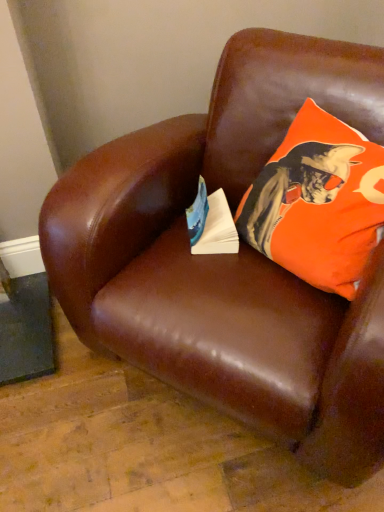
Question: Is point (203, 189) closer or farther from the camera than point (299, 224)?

Choices:
 (A) closer
 (B) farther

Answer: (B)

Question: Considering their positions, is white paper at center located in front of or behind orange fabric pillow at upper right?

Choices:
 (A) behind
 (B) front

Answer: (A)

Question: Visually, is white paper at center positioned to the left or to the right of orange fabric pillow at upper right?

Choices:
 (A) left
 (B) right

Answer: (A)

Question: Relative to white paper at center, is orange fabric pillow at upper right in front or behind?

Choices:
 (A) behind
 (B) front

Answer: (B)

Question: Does point (316, 230) appear closer or farther from the camera than point (221, 215)?

Choices:
 (A) closer
 (B) farther

Answer: (A)

Question: Visually, is orange fabric pillow at upper right positioned to the left or to the right of white paper at center?

Choices:
 (A) left
 (B) right

Answer: (B)

Question: Is orange fabric pillow at upper right inside the boundaries of white paper at center, or outside?

Choices:
 (A) outside
 (B) inside

Answer: (A)